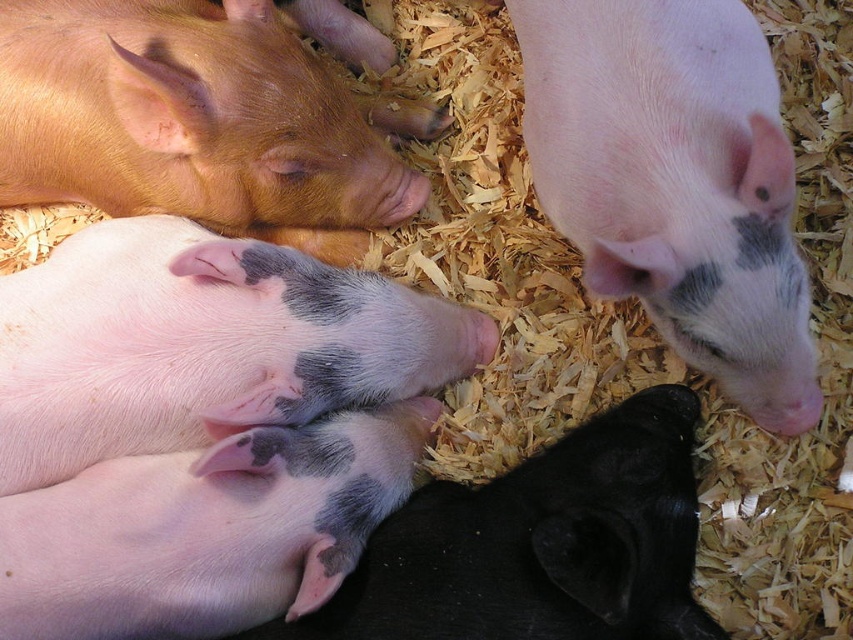
You are a farmer checking the piglets in their pen. You need to determine which piglet has a smaller width between the white matte piglet at upper right and the pink smooth piglet at lower left. Which one is smaller?

The white matte piglet at upper right has a smaller width than the pink smooth piglet at lower left according to the description.

You are a farmer checking on the piglets in their pen. You need to determine which piglet has a greater width between the pink smooth piglet at center and the pink smooth piglet at lower left. Which one is wider?

The pink smooth piglet at center is wider than the pink smooth piglet at lower left.